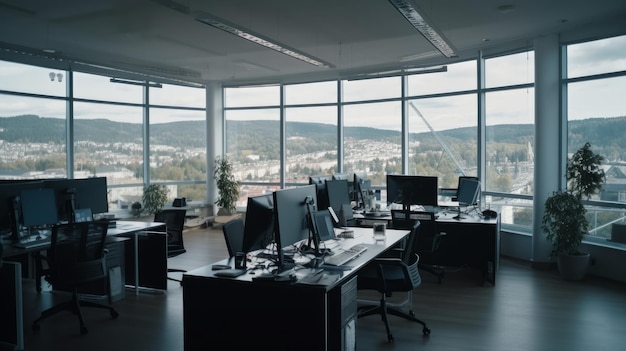
I want to click on dark floor in office, so click(x=228, y=167), click(x=228, y=192), click(x=203, y=246), click(x=140, y=319), click(x=511, y=327), click(x=506, y=278).